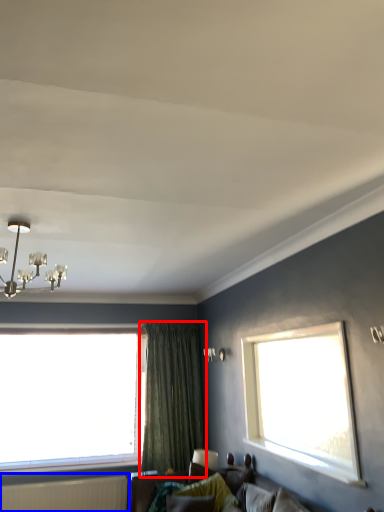
Question: Which object appears closest to the camera in this image, curtain (highlighted by a red box) or radiator (highlighted by a blue box)?

Choices:
 (A) curtain
 (B) radiator

Answer: (B)